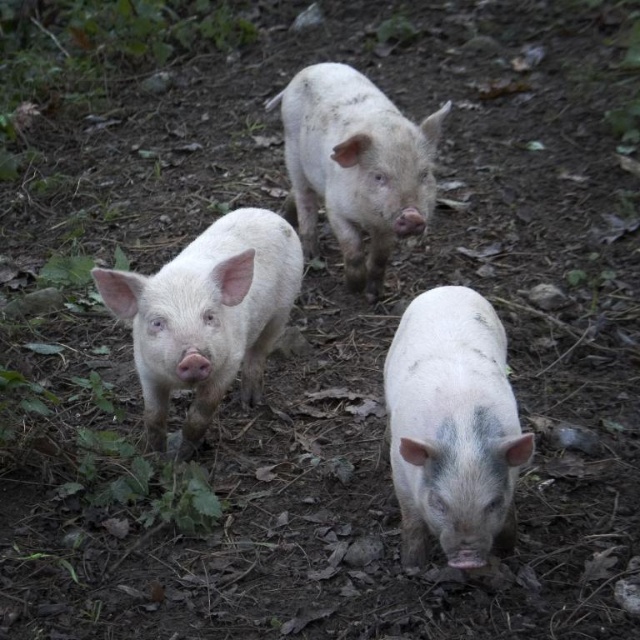
You are standing 5 feet away from the speckled pink piglet at center. Can you reach out and touch it without moving your feet?

The speckled pink piglet at center and camera are 4.49 feet apart, so yes, you can reach out and touch it since you are only 5 feet away from it.

You are a photographer trying to capture a photo of the speckled pink piglet at center and the white matte pig at center. Which pig is on the left side when you look at them from your current position?

The white matte pig at center is on the left side because the speckled pink piglet at center is positioned on the right side of it.

You are a photographer trying to capture the smooth pink piglet at center in the image. If the camera is focused at coordinates point 0.5, 0.3, will the piglet be in focus?

The smooth pink piglet at center is at point [208,314], which is very close to the focus point [192,320]. Therefore, the piglet will likely be in focus.